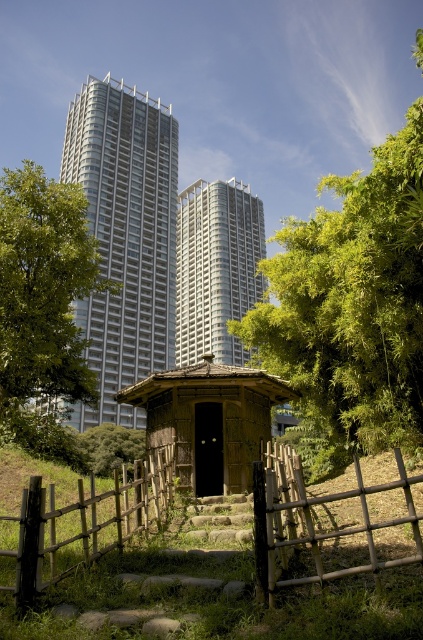
Question: Which point is farther to the camera?

Choices:
 (A) (95, 225)
 (B) (233, 385)

Answer: (A)

Question: Which point is farther to the camera?

Choices:
 (A) white glassy building at center
 (B) wooden rustic gate at center
 (C) green leafy tree at right

Answer: (A)

Question: Which object is farther from the camera taking this photo?

Choices:
 (A) green leafy tree at center
 (B) green leafy tree at right
 (C) silver glass tower at center
 (D) wooden hut at center

Answer: (A)

Question: Is wooden hut at center bigger than green leafy tree at center?

Choices:
 (A) yes
 (B) no

Answer: (B)

Question: Does wooden hut at center have a lesser width compared to brown wooden gate at lower center?

Choices:
 (A) no
 (B) yes

Answer: (A)

Question: Is wooden rustic gate at center smaller than white glassy building at center?

Choices:
 (A) no
 (B) yes

Answer: (B)